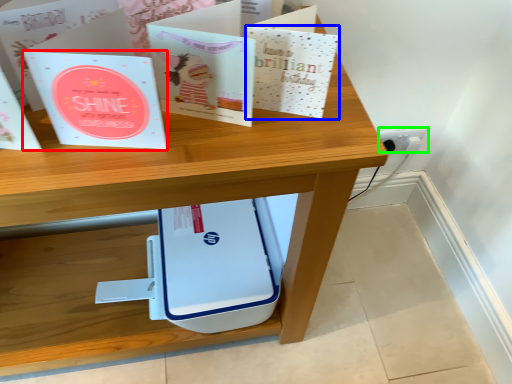
Question: Considering the real-world distances, which object is closest to paperback book (highlighted by a red box)? paperback book (highlighted by a blue box) or electric outlet (highlighted by a green box).

Choices:
 (A) paperback book
 (B) electric outlet

Answer: (A)